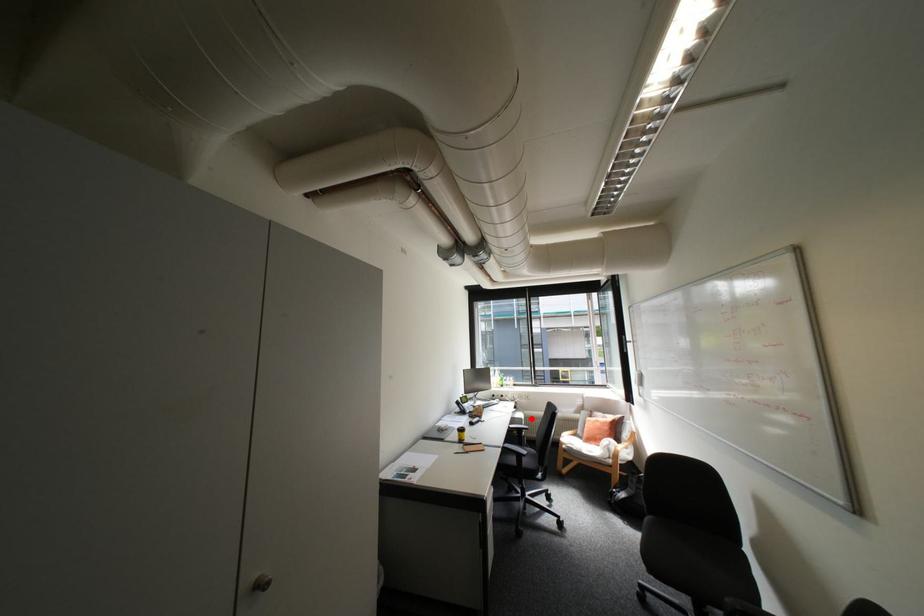
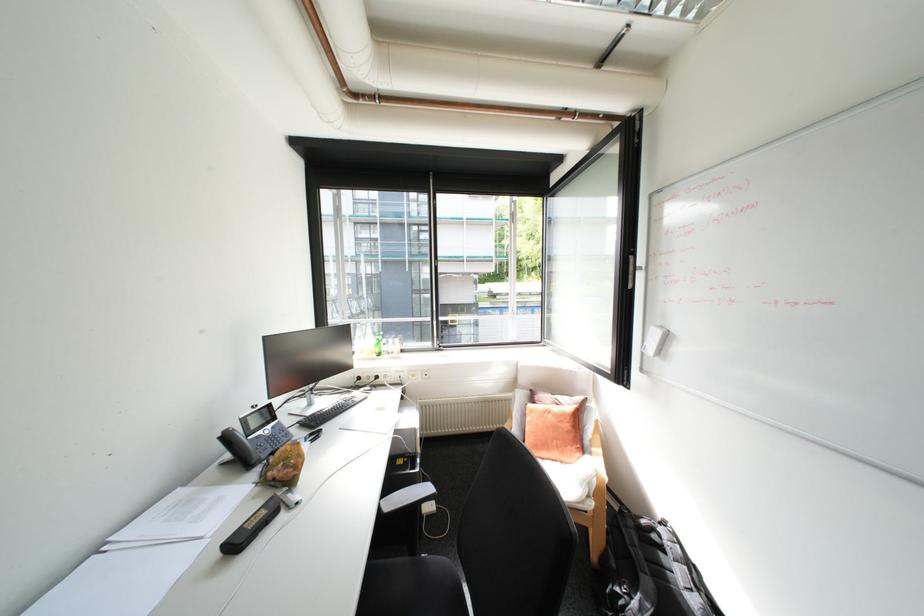
Where in the second image is the point corresponding to the highlighted location from the first image?

(424, 429)